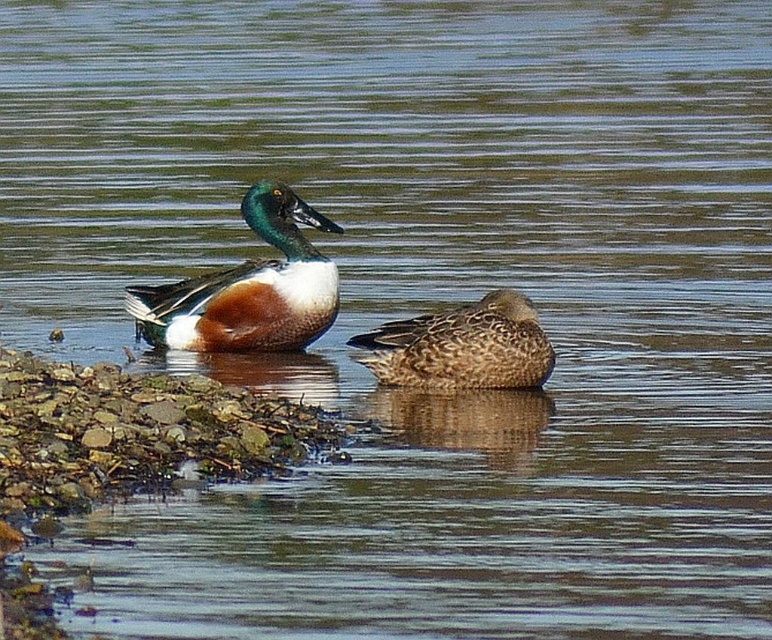
Question: Can you confirm if shiny green duck at center is positioned to the right of brown speckled duck at center?

Choices:
 (A) no
 (B) yes

Answer: (A)

Question: Which object is farther from the camera taking this photo?

Choices:
 (A) shiny green duck at center
 (B) brown speckled duck at center

Answer: (A)

Question: Does shiny green duck at center appear over brown speckled duck at center?

Choices:
 (A) yes
 (B) no

Answer: (A)

Question: Does shiny green duck at center appear on the left side of brown speckled duck at center?

Choices:
 (A) no
 (B) yes

Answer: (B)

Question: Which point appears closest to the camera in this image?

Choices:
 (A) (303, 280)
 (B) (543, 358)

Answer: (B)

Question: Which point is closer to the camera taking this photo?

Choices:
 (A) (273, 225)
 (B) (478, 323)

Answer: (B)